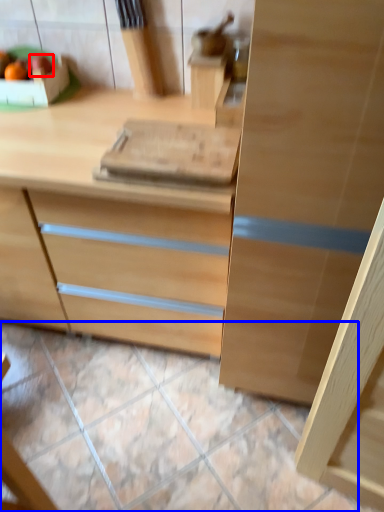
Question: Among these objects, which one is nearest to the camera, fruit (highlighted by a red box) or tile (highlighted by a blue box)?

Choices:
 (A) fruit
 (B) tile

Answer: (B)